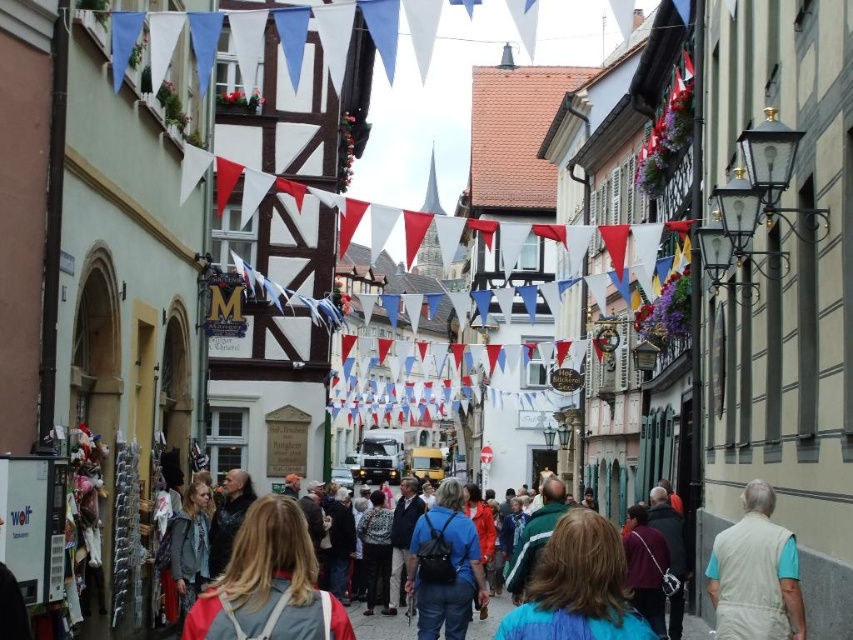
Who is lower down, blue fabric jacket at center or purple fabric purse at center?

blue fabric jacket at center

Is blue fabric jacket at center closer to camera compared to purple fabric purse at center?

Yes, blue fabric jacket at center is closer to the viewer.

Does point (595, 552) come farther from viewer compared to point (636, 595)?

That is False.

Identify the location of blue fabric jacket at center. pyautogui.click(x=577, y=586).

Can you confirm if blue fabric jacket at center is thinner than beige fabric vest at lower right?

No, blue fabric jacket at center is not thinner than beige fabric vest at lower right.

Can you confirm if blue fabric jacket at center is positioned above beige fabric vest at lower right?

No.

This screenshot has width=853, height=640. In order to click on blue fabric jacket at center in this screenshot , I will do `click(577, 586)`.

You are a GUI agent. You are given a task and a screenshot of the screen. Output one action in this format:
    pyautogui.click(x=<x>, y=<y>)
    Task: Click on the blue fabric jacket at center
    The image size is (853, 640).
    Given the screenshot: What is the action you would take?
    [577, 586]

Is gray fabric backpack at center further to the viewer compared to blue fabric backpack at center?

No, gray fabric backpack at center is closer to the viewer.

Does gray fabric backpack at center have a lesser height compared to blue fabric backpack at center?

In fact, gray fabric backpack at center may be taller than blue fabric backpack at center.

The image size is (853, 640). I want to click on gray fabric backpack at center, so click(268, 582).

Locate an element on the screen. This screenshot has height=640, width=853. gray fabric backpack at center is located at coordinates (268, 582).